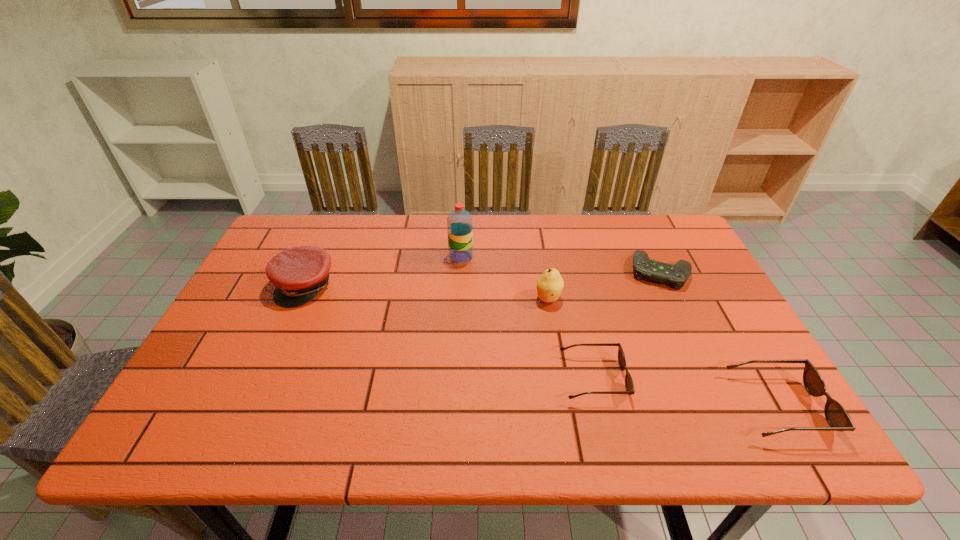
I want to click on object positioned at the near right corner, so click(x=837, y=417).

I want to click on vacant space at the far edge of the desktop, so click(x=363, y=234).

Locate an element on the screen. Image resolution: width=960 pixels, height=540 pixels. free space at the near edge is located at coordinates (354, 385).

Where is `free space at the right edge of the desktop`? The width and height of the screenshot is (960, 540). free space at the right edge of the desktop is located at coordinates (677, 321).

You are a GUI agent. You are given a task and a screenshot of the screen. Output one action in this format:
    pyautogui.click(x=<x>, y=<y>)
    Task: Click on the vacant region at the far right corner of the desktop
    This screenshot has width=960, height=540.
    Given the screenshot: What is the action you would take?
    pyautogui.click(x=657, y=251)

Find the location of `vacant area at the near right corner`. vacant area at the near right corner is located at coordinates (785, 407).

Locate an element on the screen. vacant area that lies between the taller sunglasses and the third tallest object is located at coordinates (541, 346).

Locate an element on the screen. The width and height of the screenshot is (960, 540). free space between the leftmost object and the taller sunglasses is located at coordinates (541, 346).

Where is `empty location between the tallest object and the leftmost object`? empty location between the tallest object and the leftmost object is located at coordinates (383, 271).

The image size is (960, 540). In order to click on free space between the second object from left to right and the fourth shortest object in this screenshot , I will do `click(383, 271)`.